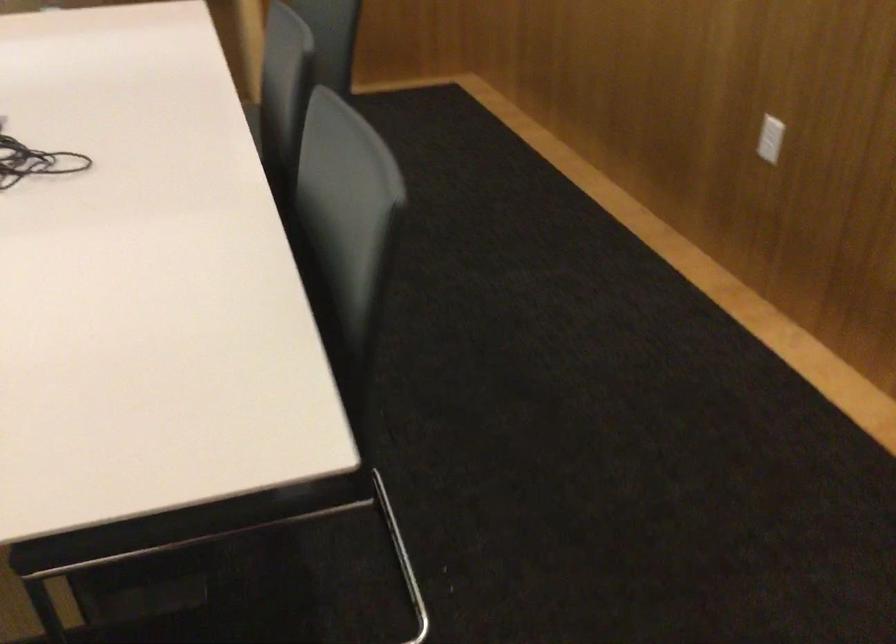
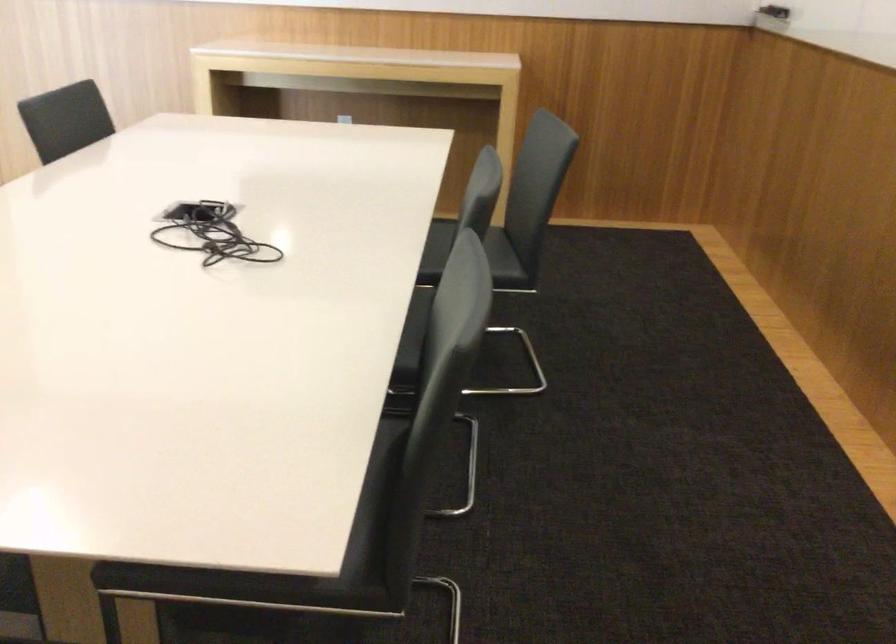
Question: In a continuous first-person perspective shot, in which direction is the camera moving?

Choices:
 (A) Left
 (B) Right
 (C) Forward
 (D) Backward

Answer: (B)